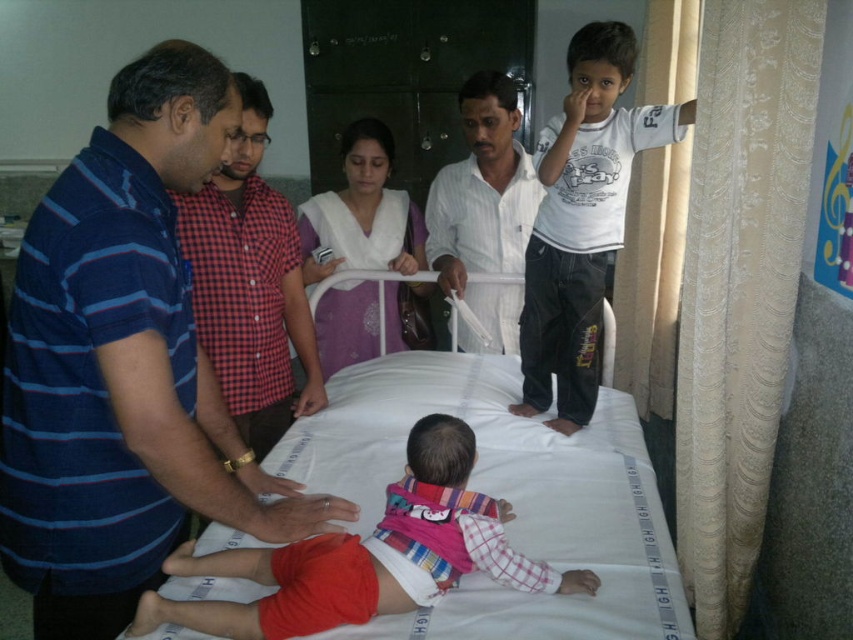
Question: Does blue striped shirt at center appear over striped fabric baby at center?

Choices:
 (A) yes
 (B) no

Answer: (A)

Question: Can you confirm if striped fabric baby at center is positioned to the right of blue striped shirt at left?

Choices:
 (A) no
 (B) yes

Answer: (B)

Question: Which object is farther from the camera taking this photo?

Choices:
 (A) white cotton shirt at upper right
 (B) blue striped shirt at center

Answer: (A)

Question: Which point is farther from the camera taking this photo?

Choices:
 (A) (407, 602)
 (B) (219, 440)
 (C) (572, 166)
 (D) (230, 205)

Answer: (C)

Question: Which point is closer to the camera?

Choices:
 (A) (265, 272)
 (B) (393, 582)
 (C) (473, 246)

Answer: (B)

Question: Can you confirm if white cotton shirt at upper right is positioned to the right of white striped shirt at center?

Choices:
 (A) yes
 (B) no

Answer: (A)